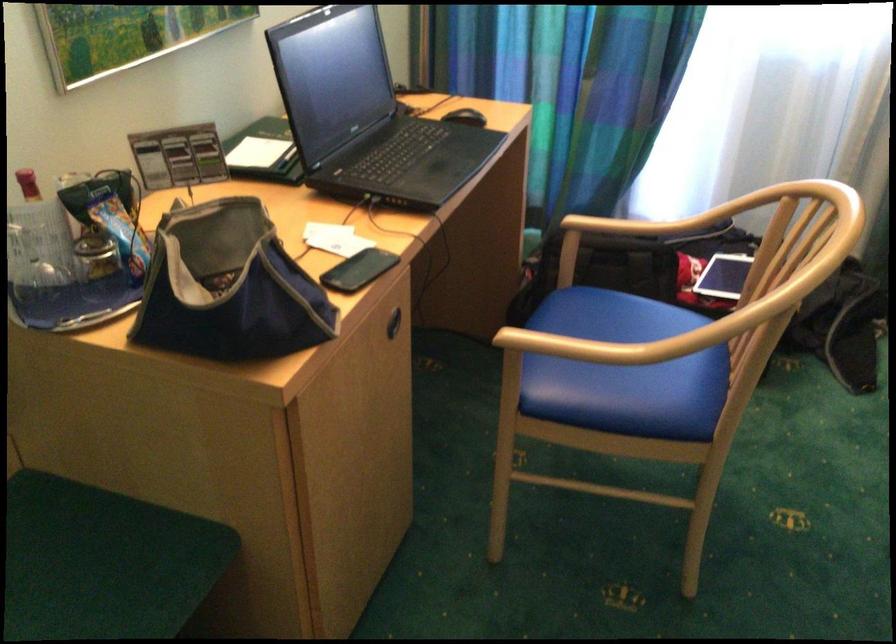
In order to click on drawer handle in this screenshot , I will do `click(393, 323)`.